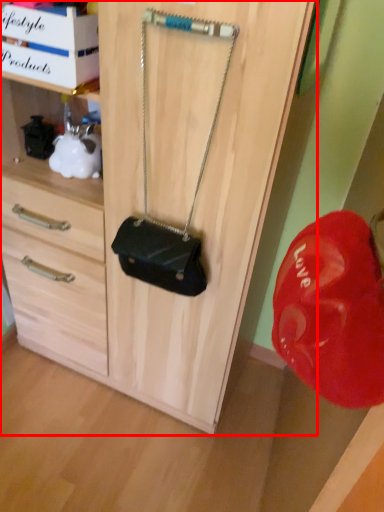
Question: From the image's perspective, where is cabinetry (annotated by the red box) located relative to handbag?

Choices:
 (A) below
 (B) above

Answer: (A)